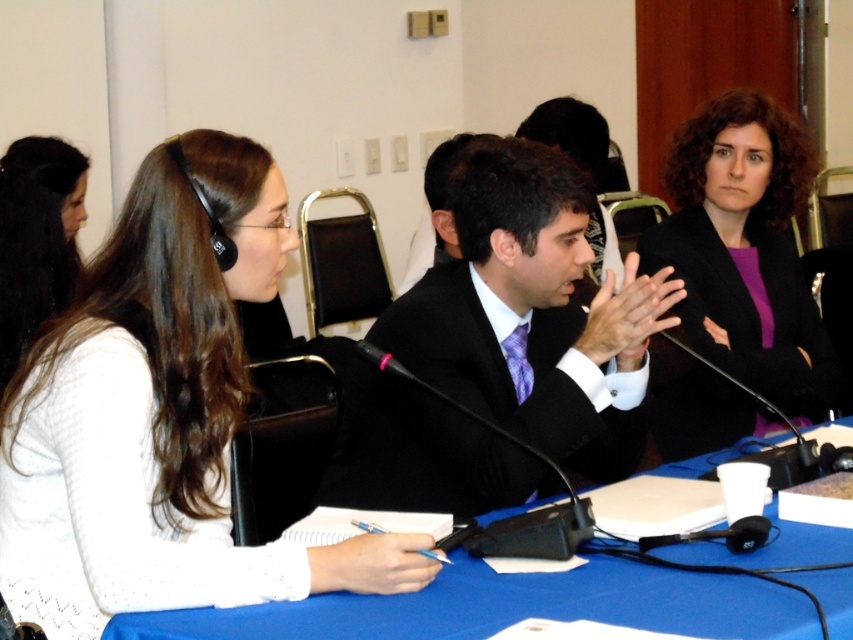
Question: Estimate the real-world distances between objects in this image. Which object is closer to the white matte sweater at left?

Choices:
 (A) smooth white shirt at left
 (B) black satin suit at center
 (C) blue fabric table at center

Answer: (C)

Question: Does white matte sweater at left lie behind blue fabric table at center?

Choices:
 (A) no
 (B) yes

Answer: (B)

Question: In this image, where is purple matte blazer at upper right located relative to smooth white shirt at left?

Choices:
 (A) above
 (B) below

Answer: (B)

Question: Does blue fabric table at center have a lesser width compared to smooth white shirt at left?

Choices:
 (A) no
 (B) yes

Answer: (A)

Question: Which object appears closest to the camera in this image?

Choices:
 (A) smooth white shirt at left
 (B) purple matte blazer at upper right

Answer: (B)

Question: Which point appears farthest from the camera in this image?

Choices:
 (A) (788, 182)
 (B) (506, 244)

Answer: (A)